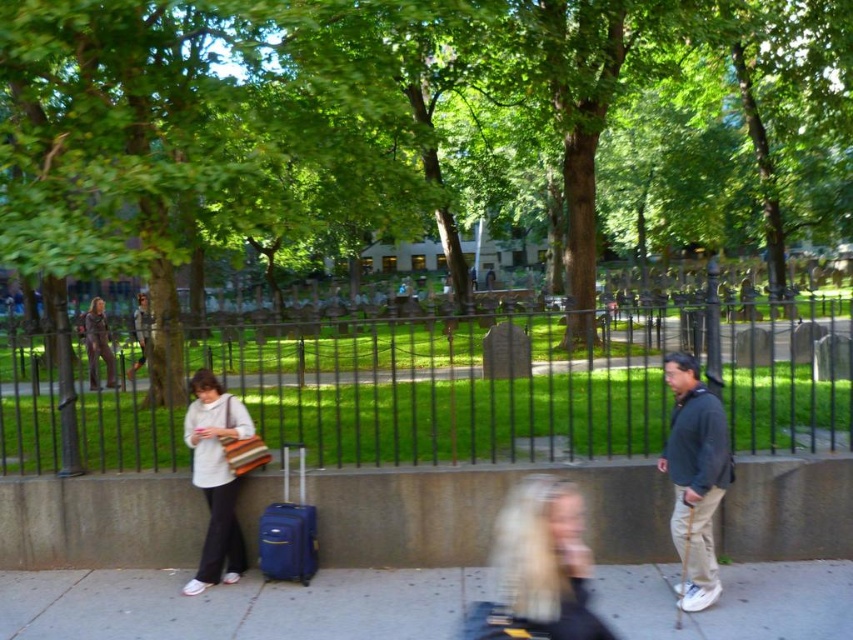
You are a photographer trying to capture a portrait of the person with blonde hair at center and matte brown pants at center. Since the person is walking away from the camera, will you be able to clearly see their face in the photo?

The blonde hair at center is located below matte brown pants at center, so the face is not visible as the back is facing the camera.

Based on the photo, you are a photographer standing at the park and want to capture a photo of the blonde hair at center and the matte brown pants at center in the same frame. The camera you are using has a maximum focus range of 30 feet. Will both subjects be in focus if you take the photo from your current position?

The blonde hair at center and the matte brown pants at center are 29.05 feet apart. Since the maximum focus range is 30 feet, both subjects will be in focus as the distance between them is within the camera range.